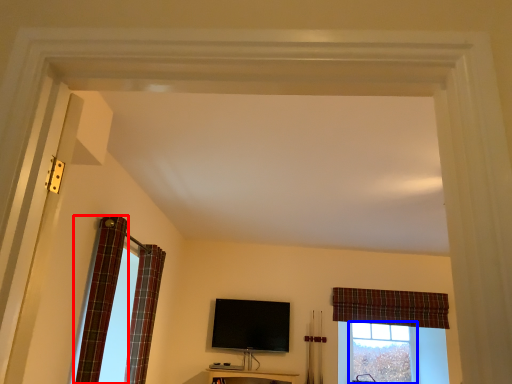
Question: Which point is closer to the camera, curtain (highlighted by a red box) or bay window (highlighted by a blue box)?

Choices:
 (A) curtain
 (B) bay window

Answer: (A)